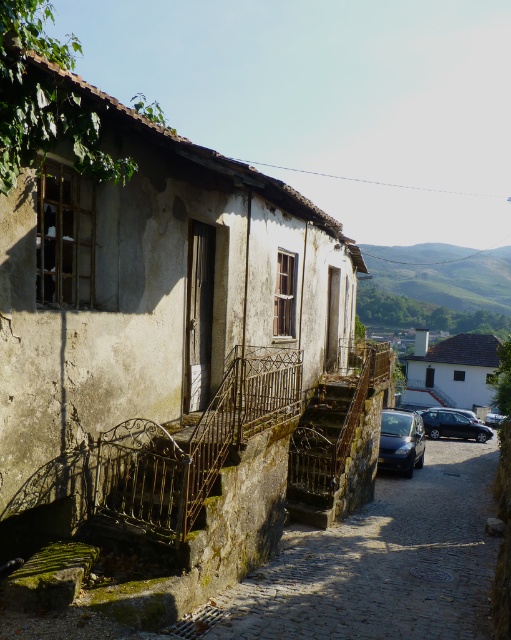
Describe the element at coordinates (380, 563) in the screenshot. I see `rusty metal stairs at lower left` at that location.

Which is in front, point (337, 550) or point (403, 442)?

Positioned in front is point (337, 550).

Identify the location of rusty metal stairs at lower left. (380, 563).

Is glossy black car at lower right closer to the viewer compared to satin black car at lower right?

That is True.

Is point (422, 436) positioned before point (435, 435)?

Yes, it is.

Does point (398, 412) come closer to viewer compared to point (460, 413)?

Yes, it is in front of point (460, 413).

You are a GUI agent. You are given a task and a screenshot of the screen. Output one action in this format:
    pyautogui.click(x=<x>, y=<y>)
    Task: Click on the glossy black car at lower right
    Image resolution: width=511 pixels, height=640 pixels.
    Given the screenshot: What is the action you would take?
    pyautogui.click(x=401, y=440)

Who is positioned more to the left, rusty metal stairs at lower left or satin black car at lower right?

rusty metal stairs at lower left is more to the left.

Is point (432, 570) positioned after point (464, 419)?

No, it is not.

Is point (376, 563) behind point (466, 419)?

That is False.

Find the location of `rusty metal stairs at lower left`. rusty metal stairs at lower left is located at coordinates (380, 563).